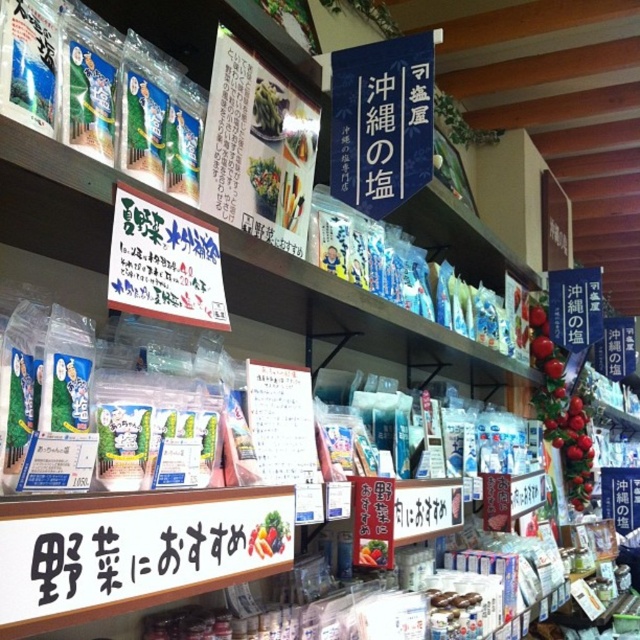
Question: Where is blue paper sign at upper center located in relation to black plastic sign at lower center in the image?

Choices:
 (A) above
 (B) below

Answer: (A)

Question: Which point is farther to the camera?

Choices:
 (A) (134, 556)
 (B) (413, 156)

Answer: (B)

Question: Among these objects, which one is farthest from the camera?

Choices:
 (A) black plastic sign at lower center
 (B) blue paper sign at upper center

Answer: (B)

Question: Is the position of blue paper sign at upper center less distant than that of black plastic sign at lower center?

Choices:
 (A) no
 (B) yes

Answer: (A)

Question: Which of the following is the closest to the observer?

Choices:
 (A) (388, 147)
 (B) (224, 564)

Answer: (B)

Question: Is blue paper sign at upper center wider than black plastic sign at lower center?

Choices:
 (A) no
 (B) yes

Answer: (B)